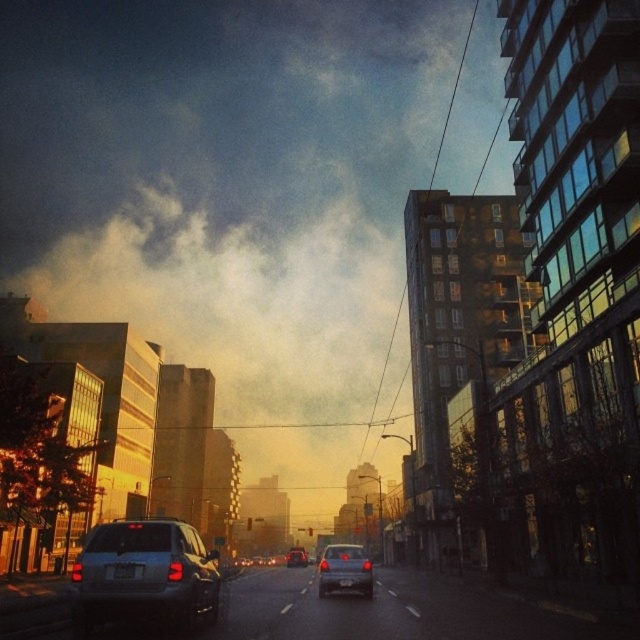
You are a city planner assessing traffic flow in the area. You notice the smokey haze at upper center and the satin silver sedan at center. How far apart are these two landmarks in meters?

The smokey haze at upper center is 419.04 meters from the satin silver sedan at center.

In the scene shown: You are a delivery person who needs to park your vehicle in a narrow parking spot that is only wide enough for a standard sedan. You see a satin silver suv at center and a satin silver sedan at center in the image. Which vehicle should you choose to park in the spot?

You should choose the satin silver sedan at center because it is narrower than the satin silver suv at center, making it suitable for the narrow parking spot.